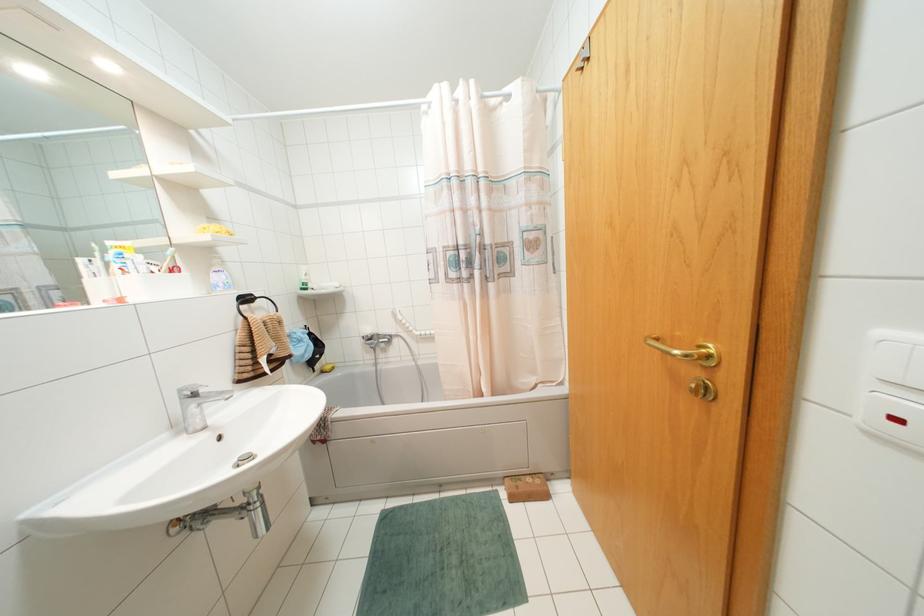
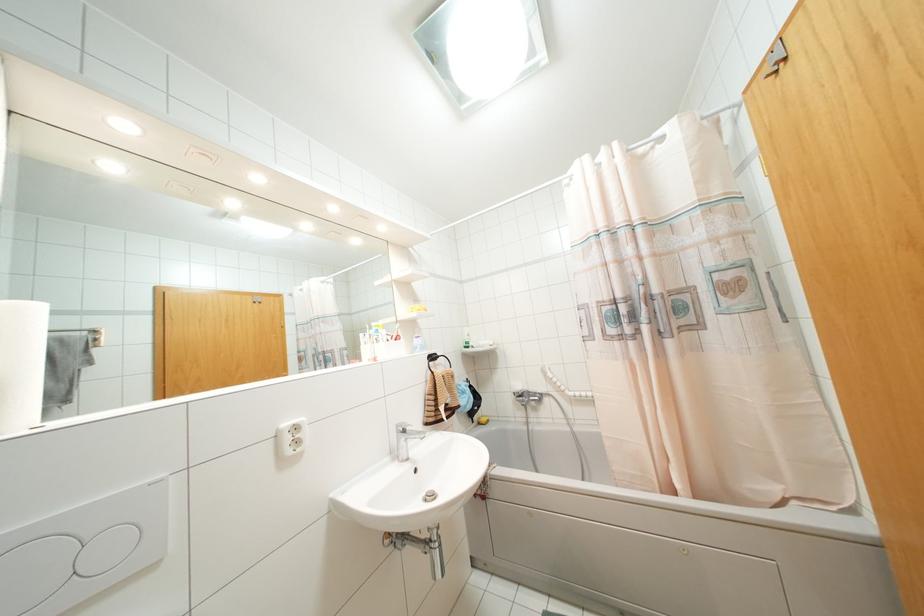
Find the pixel in the second image that matches (x=193, y=395) in the first image.

(404, 431)